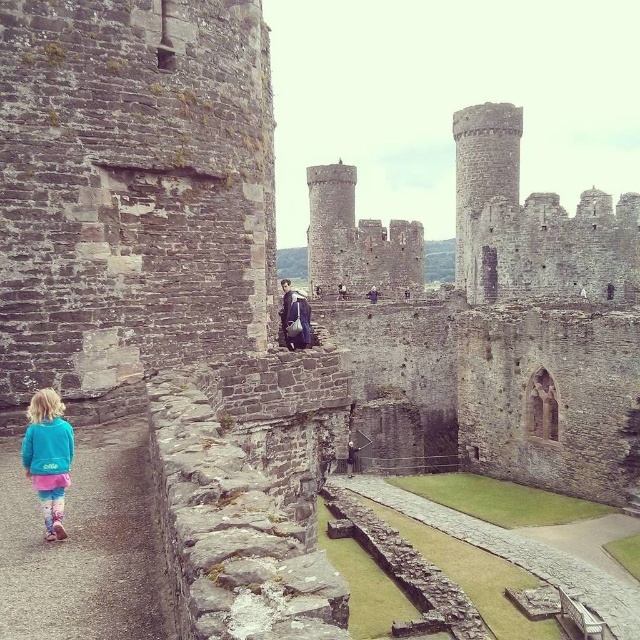
Question: Which point is closer to the camera?

Choices:
 (A) (634, 368)
 (B) (304, 326)
 (C) (371, 285)

Answer: (B)

Question: Is dark brown leather jacket at center closer to the viewer compared to dark blue jacket at center?

Choices:
 (A) no
 (B) yes

Answer: (B)

Question: Is dark brown leather jacket at center to the right of purple fabric at center from the viewer's perspective?

Choices:
 (A) yes
 (B) no

Answer: (B)

Question: Considering the real-world distances, which object is closest to the dark blue jacket at center?

Choices:
 (A) purple fabric at center
 (B) brown stone castle at center
 (C) dark brown leather jacket at center
 (D) turquoise fleece jacket at lower left

Answer: (A)

Question: Which point is farther to the camera?

Choices:
 (A) (288, 320)
 (B) (342, 289)
 (C) (48, 404)

Answer: (B)

Question: Does turquoise fleece jacket at lower left appear on the right side of dark brown leather jacket at center?

Choices:
 (A) yes
 (B) no

Answer: (A)